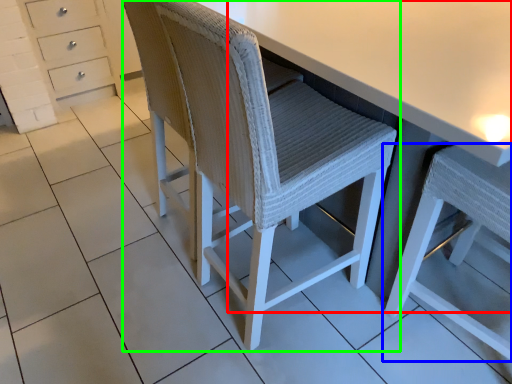
Question: Considering the real-world distances, which object is farthest from table (highlighted by a red box)? chair (highlighted by a blue box) or chair (highlighted by a green box)?

Choices:
 (A) chair
 (B) chair

Answer: (A)